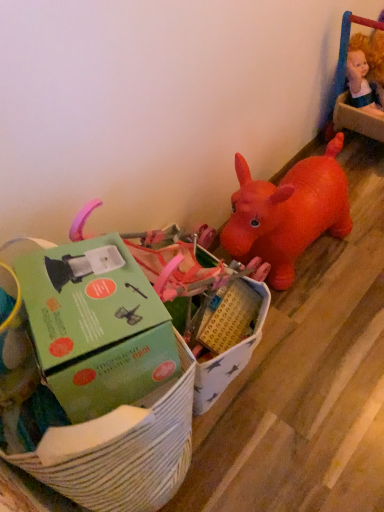
Question: Does green cardboard box at center, which is the 1th toy in front-to-back order, have a greater width compared to green cardboard box at lower left?

Choices:
 (A) no
 (B) yes

Answer: (B)

Question: From a real-world perspective, does green cardboard box at center, which is the second toy in right-to-left order, stand above green cardboard box at lower left?

Choices:
 (A) yes
 (B) no

Answer: (B)

Question: Can you confirm if green cardboard box at center, which ranks as the first toy in bottom-to-top order, is thinner than green cardboard box at lower left?

Choices:
 (A) yes
 (B) no

Answer: (B)

Question: From a real-world perspective, is green cardboard box at center, the second toy positioned from the back, positioned under green cardboard box at lower left based on gravity?

Choices:
 (A) no
 (B) yes

Answer: (B)

Question: Is green cardboard box at center, the second toy positioned from the back, taller than green cardboard box at lower left?

Choices:
 (A) yes
 (B) no

Answer: (A)

Question: Considering the positions of green cardboard box at lower left and smooth plastic doll at upper right, which is the 2th toy in front-to-back order, in the image, is green cardboard box at lower left wider or thinner than smooth plastic doll at upper right, which is the 2th toy in front-to-back order,?

Choices:
 (A) thin
 (B) wide

Answer: (B)

Question: From a real-world perspective, relative to smooth plastic doll at upper right, which is the second toy in left-to-right order, is green cardboard box at lower left vertically above or below?

Choices:
 (A) above
 (B) below

Answer: (A)

Question: From their relative heights in the image, would you say green cardboard box at lower left is taller or shorter than smooth plastic doll at upper right, which is the second toy in left-to-right order?

Choices:
 (A) short
 (B) tall

Answer: (A)

Question: Is green cardboard box at lower left situated inside smooth plastic doll at upper right, which is the second toy in left-to-right order, or outside?

Choices:
 (A) inside
 (B) outside

Answer: (B)

Question: Is green cardboard box at center, which is the 1th toy from left to right, taller or shorter than green cardboard box at lower left?

Choices:
 (A) short
 (B) tall

Answer: (B)

Question: From a real-world perspective, is green cardboard box at center, which is the second toy in right-to-left order, above or below green cardboard box at lower left?

Choices:
 (A) above
 (B) below

Answer: (B)

Question: From the image's perspective, relative to green cardboard box at lower left, is green cardboard box at center, which ranks as the first toy in bottom-to-top order, above or below?

Choices:
 (A) above
 (B) below

Answer: (B)

Question: Is green cardboard box at center, which is the 1th toy from left to right, spatially inside green cardboard box at lower left, or outside of it?

Choices:
 (A) outside
 (B) inside

Answer: (A)

Question: Considering their positions, is smooth plastic doll at upper right, which is the second toy in bottom-to-top order, located in front of or behind green cardboard box at center, the 2th toy from the top?

Choices:
 (A) behind
 (B) front

Answer: (A)

Question: From the image's perspective, is smooth plastic doll at upper right, which is the second toy in bottom-to-top order, above or below green cardboard box at center, which ranks as the first toy in bottom-to-top order?

Choices:
 (A) below
 (B) above

Answer: (B)